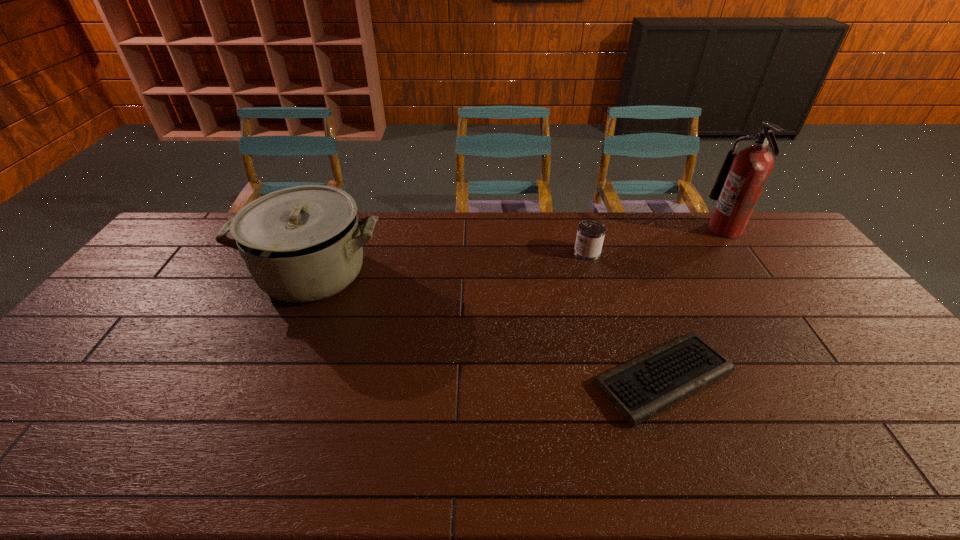
This screenshot has width=960, height=540. I want to click on vacant space situated on the left of the saucepan, so click(193, 274).

At what (x,y) coordinates should I click in order to perform the action: click on free space located 0.240m on the left of the third tallest object. Please return your answer as a coordinate pair (x, y). Looking at the image, I should click on (504, 253).

Where is `free region located on the back of the nearest object`? The image size is (960, 540). free region located on the back of the nearest object is located at coordinates (633, 298).

The height and width of the screenshot is (540, 960). In order to click on fire extinguisher that is at the far edge in this screenshot , I will do `click(741, 180)`.

You are a GUI agent. You are given a task and a screenshot of the screen. Output one action in this format:
    pyautogui.click(x=<x>, y=<y>)
    Task: Click on the saucepan that is at the far edge
    
    Given the screenshot: What is the action you would take?
    pyautogui.click(x=301, y=244)

The height and width of the screenshot is (540, 960). What are the coordinates of `can present at the far edge` in the screenshot? It's located at 590,235.

Identify the location of object that is at the right edge. (741, 180).

Locate an element on the screen. object that is positioned at the far right corner is located at coordinates pyautogui.click(x=741, y=180).

You are a GUI agent. You are given a task and a screenshot of the screen. Output one action in this format:
    pyautogui.click(x=<x>, y=<y>)
    Task: Click on the blank space at the far edge of the desktop
    The height and width of the screenshot is (540, 960).
    Given the screenshot: What is the action you would take?
    pyautogui.click(x=408, y=215)

This screenshot has width=960, height=540. What are the coordinates of `vacant area at the left edge of the desktop` in the screenshot? It's located at (44, 402).